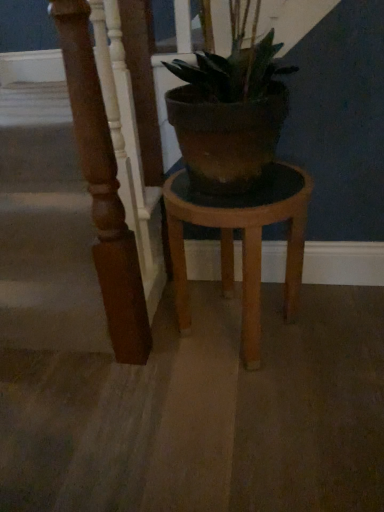
In order to face brown polished wood pillar at left, should I rotate leftwards or rightwards?

To face it directly, rotate left by 8.723 degrees.

Find the location of a particular element. brown polished wood pillar at left is located at coordinates (103, 189).

The height and width of the screenshot is (512, 384). What do you see at coordinates (103, 189) in the screenshot?
I see `brown polished wood pillar at left` at bounding box center [103, 189].

Where is `wooden stool at center`? wooden stool at center is located at coordinates (242, 242).

Describe the element at coordinates (242, 242) in the screenshot. I see `wooden stool at center` at that location.

What is the approximate height of wooden stool at center?

wooden stool at center is 19.92 inches tall.

You are a GUI agent. You are given a task and a screenshot of the screen. Output one action in this format:
    pyautogui.click(x=<x>, y=<y>)
    Task: Click on the brown polished wood pillar at left
    This screenshot has width=384, height=512.
    Given the screenshot: What is the action you would take?
    pyautogui.click(x=103, y=189)

Does wooden stool at center appear on the right side of brown polished wood pillar at left?

Yes.

Considering the positions of objects wooden stool at center and brown polished wood pillar at left in the image provided, who is behind, wooden stool at center or brown polished wood pillar at left?

wooden stool at center is more distant.

Which is further, (x=256, y=246) or (x=116, y=326)?

The point (x=116, y=326) is farther.

From the image's perspective, is wooden stool at center on top of brown polished wood pillar at left?

Incorrect, from the image's perspective, wooden stool at center is lower than brown polished wood pillar at left.

From a real-world perspective, is wooden stool at center on top of brown polished wood pillar at left?

No, from a real-world perspective, wooden stool at center is not above brown polished wood pillar at left.

Can you confirm if wooden stool at center is thinner than brown polished wood pillar at left?

No, wooden stool at center is not thinner than brown polished wood pillar at left.

Looking at this image, considering the relative sizes of wooden stool at center and brown polished wood pillar at left in the image provided, is wooden stool at center shorter than brown polished wood pillar at left?

Yes, wooden stool at center is shorter than brown polished wood pillar at left.

From the picture: Between wooden stool at center and brown polished wood pillar at left, which one has smaller size?

With smaller size is brown polished wood pillar at left.

Looking at this image, is wooden stool at center not within brown polished wood pillar at left?

Absolutely, wooden stool at center is external to brown polished wood pillar at left.

Is wooden stool at center with brown polished wood pillar at left?

wooden stool at center is not next to brown polished wood pillar at left, and they're not touching.

Could you tell me if wooden stool at center is turned towards brown polished wood pillar at left?

No, wooden stool at center is not oriented towards brown polished wood pillar at left.

The image size is (384, 512). In order to click on stool below the brown polished wood pillar at left (from a real-world perspective) in this screenshot , I will do `click(242, 242)`.

Considering the positions of objects brown polished wood pillar at left and wooden stool at center in the image provided, who is more to the right, brown polished wood pillar at left or wooden stool at center?

wooden stool at center.

Between brown polished wood pillar at left and wooden stool at center, which one is positioned in front?

brown polished wood pillar at left is more forward.

Considering the points (140, 298) and (214, 199), which point is in front, point (140, 298) or point (214, 199)?

The point (214, 199) is closer.

From the image's perspective, is brown polished wood pillar at left above or below wooden stool at center?

brown polished wood pillar at left is situated higher than wooden stool at center in the image.

From a real-world perspective, who is located higher, brown polished wood pillar at left or wooden stool at center?

From a 3D spatial view, brown polished wood pillar at left is above.

Considering the sizes of objects brown polished wood pillar at left and wooden stool at center in the image provided, who is thinner, brown polished wood pillar at left or wooden stool at center?

With smaller width is brown polished wood pillar at left.

Considering the sizes of objects brown polished wood pillar at left and wooden stool at center in the image provided, who is taller, brown polished wood pillar at left or wooden stool at center?

brown polished wood pillar at left.

Who is bigger, brown polished wood pillar at left or wooden stool at center?

With larger size is wooden stool at center.

Would you say wooden stool at center is part of brown polished wood pillar at left's contents?

That's incorrect, wooden stool at center is not inside brown polished wood pillar at left.

Is brown polished wood pillar at left not close to wooden stool at center?

That's not correct — brown polished wood pillar at left is a little close to wooden stool at center.

Is brown polished wood pillar at left looking in the opposite direction of wooden stool at center?

Correct, brown polished wood pillar at left is looking away from wooden stool at center.

This screenshot has height=512, width=384. I want to click on pillar that appears above the wooden stool at center (from the image's perspective), so coord(103,189).

Find the location of a particular element. stool located below the brown polished wood pillar at left (from the image's perspective) is located at coordinates (242, 242).

Find the location of a particular element. stool on the right of brown polished wood pillar at left is located at coordinates (242, 242).